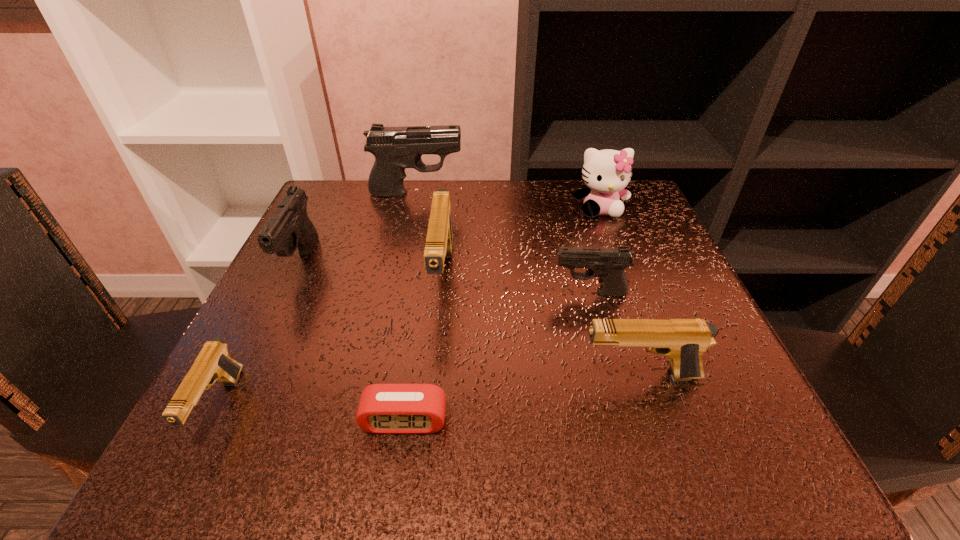
Find the location of a particular element. The height and width of the screenshot is (540, 960). the leftmost tan pistol is located at coordinates (213, 363).

I want to click on pink alarm clock, so click(x=383, y=408).

Locate an element on the screen. alarm clock is located at coordinates (383, 408).

Locate an element on the screen. The image size is (960, 540). vacant space located 0.330m at the barrel of the tallest pistol is located at coordinates (599, 193).

Where is `free space located 0.400m on the front-facing side of the white kitten`? The height and width of the screenshot is (540, 960). free space located 0.400m on the front-facing side of the white kitten is located at coordinates (660, 368).

At what (x,y) coordinates should I click in order to perform the action: click on vacant area situated at the barrel of the second tan pistol from left to right. Please return your answer as a coordinate pair (x, y). The height and width of the screenshot is (540, 960). Looking at the image, I should click on (428, 429).

This screenshot has width=960, height=540. What are the coordinates of `blank space located 0.200m at the barrel of the leftmost black pistol` in the screenshot? It's located at (242, 388).

Image resolution: width=960 pixels, height=540 pixels. What are the coordinates of `vacant space located at the barrel of the second smallest tan pistol` in the screenshot? It's located at (514, 376).

This screenshot has height=540, width=960. In order to click on vacant area situated 0.100m at the barrel of the second smallest tan pistol in this screenshot , I will do `click(514, 376)`.

Locate an element on the screen. The image size is (960, 540). free region located 0.390m at the barrel of the second smallest tan pistol is located at coordinates (321, 376).